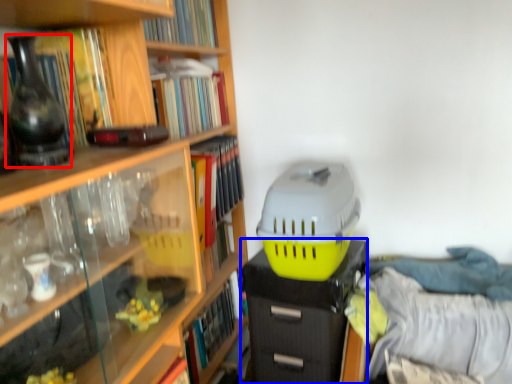
Question: Which of the following is the closest to the observer, vase (highlighted by a red box) or file cabinet (highlighted by a blue box)?

Choices:
 (A) vase
 (B) file cabinet

Answer: (A)